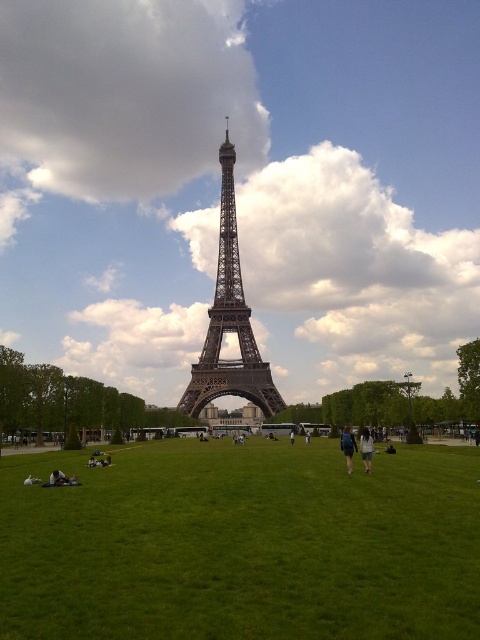
Question: Does dark blue jeans at center come behind dark blue fabric jacket at lower center?

Choices:
 (A) no
 (B) yes

Answer: (B)

Question: Which of the following is the closest to the observer?

Choices:
 (A) green grass at center
 (B) metallic gray eiffel tower at center
 (C) matte metal eiffel tower at center
 (D) dark blue fabric jacket at lower center

Answer: (A)

Question: Estimate the real-world distances between objects in this image. Which object is farther from the dark blue fabric jacket at lower center?

Choices:
 (A) metallic gray eiffel tower at center
 (B) dark blue jeans at center
 (C) green grass at center
 (D) matte metal eiffel tower at center

Answer: (D)

Question: Does matte metal eiffel tower at center have a larger size compared to dark blue jeans at center?

Choices:
 (A) no
 (B) yes

Answer: (B)

Question: Does matte metal eiffel tower at center appear over dark blue fabric jacket at lower center?

Choices:
 (A) yes
 (B) no

Answer: (A)

Question: Which is farther from the dark blue jeans at center?

Choices:
 (A) green grass at center
 (B) matte metal eiffel tower at center
 (C) dark blue fabric jacket at lower center
 (D) metallic gray eiffel tower at center

Answer: (B)